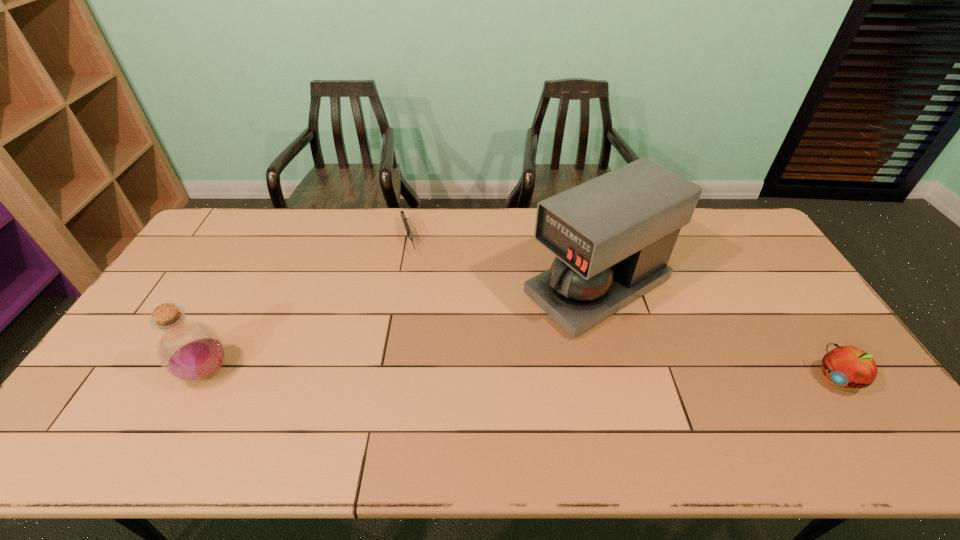
The width and height of the screenshot is (960, 540). In order to click on free space on the desktop that is between the leftmost object and the rightmost object and is positioned aimed along the barrel of the gun in this screenshot , I will do `click(457, 375)`.

Find the location of `vacant spot on the desktop that is between the bottle and the apple and is positioned on the carafe side of the coffee maker`. vacant spot on the desktop that is between the bottle and the apple and is positioned on the carafe side of the coffee maker is located at coordinates (446, 375).